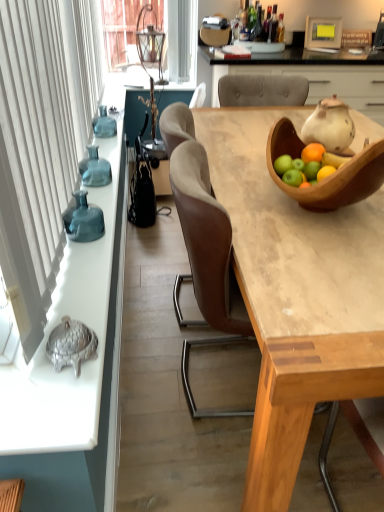
You are a GUI agent. You are given a task and a screenshot of the screen. Output one action in this format:
    pyautogui.click(x=<x>, y=<y>)
    Task: Click on the wooden cabinet at upper center
    Image resolution: width=384 pixels, height=512 pixels.
    Given the screenshot: What is the action you would take?
    pyautogui.click(x=308, y=75)

What is the approximate height of metallic silver turtle at left?

The height of metallic silver turtle at left is 0.94 inches.

What is the approximate width of metallic silver turtle at left?

metallic silver turtle at left is 9.29 inches in width.

Measure the distance between translucent glass vase at left and camera.

A distance of 2.25 meters exists between translucent glass vase at left and camera.

Where is `translucent glass vase at left`? The height and width of the screenshot is (512, 384). translucent glass vase at left is located at coordinates (104, 124).

Where is `wooden bowl at upper right`? The height and width of the screenshot is (512, 384). wooden bowl at upper right is located at coordinates [x=331, y=175].

Locate an element on the screen. wooden cabinet at upper center is located at coordinates (308, 75).

Identify the location of countertop below the translucent glass vase at left (from the image's perspective). The height and width of the screenshot is (512, 384). (47, 339).

Consider the image. Considering the relative sizes of translucent glass vase at left and metallic silver turtle at left in the image provided, is translucent glass vase at left thinner than metallic silver turtle at left?

Correct, the width of translucent glass vase at left is less than that of metallic silver turtle at left.

From the image's perspective, between translucent glass vase at left and metallic silver turtle at left, who is located below?

metallic silver turtle at left appears lower in the image.

Is translucent glass vase at left far away from metallic silver turtle at left?

No, there isn't a large distance between translucent glass vase at left and metallic silver turtle at left.

Does point (103, 161) come behind point (296, 197)?

Yes, it is behind point (296, 197).

Would you say wooden bowl at upper right is part of translucent glass vase at left, the first vase viewed from the back,'s contents?

No, wooden bowl at upper right is not surrounded by translucent glass vase at left, the first vase viewed from the back.

Does translucent glass vase at left, the first vase viewed from the back, have a greater width compared to wooden bowl at upper right?

No, translucent glass vase at left, the first vase viewed from the back, is not wider than wooden bowl at upper right.

Is translucent glass vase at left, the 2th vase from the bottom, touching wooden bowl at upper right?

There is a gap between translucent glass vase at left, the 2th vase from the bottom, and wooden bowl at upper right.

Does translucent glass vase at left, which is the 1th vase from top to bottom, have a lesser height compared to wooden table at center?

Indeed, translucent glass vase at left, which is the 1th vase from top to bottom, has a lesser height compared to wooden table at center.

Is translucent glass vase at left, the second vase positioned from the front, bigger than wooden table at center?

Incorrect, translucent glass vase at left, the second vase positioned from the front, is not larger than wooden table at center.

Identify the location of the 2nd vase located above the wooden table at center (from a real-world perspective). (95, 169).

Where is `desk lying in front of the wooden cabinet at upper center`? Image resolution: width=384 pixels, height=512 pixels. desk lying in front of the wooden cabinet at upper center is located at coordinates (295, 294).

Would you say wooden table at center is outside wooden cabinet at upper center?

Absolutely, wooden table at center is external to wooden cabinet at upper center.

Who is shorter, wooden table at center or wooden cabinet at upper center?

wooden cabinet at upper center.

Would you say metallic silver turtle at left is to the left or to the right of translucent glass vase at left in the picture?

In the image, metallic silver turtle at left appears on the left side of translucent glass vase at left.

Is metallic silver turtle at left aimed at translucent glass vase at left?

No, metallic silver turtle at left is not facing towards translucent glass vase at left.

Considering their positions, is metallic silver turtle at left located in front of or behind translucent glass vase at left?

Visually, metallic silver turtle at left is located in front of translucent glass vase at left.

Which of these two, metallic silver turtle at left or translucent glass vase at left, stands taller?

With more height is translucent glass vase at left.

Between translucent glass vase at left and teal glass vase at left, which is counted as the second vase, starting from the back, which one appears on the left side from the viewer's perspective?

From the viewer's perspective, translucent glass vase at left appears more on the left side.

From a real-world perspective, is translucent glass vase at left positioned above or below teal glass vase at left, which is counted as the second vase, starting from the back?

translucent glass vase at left is situated higher than teal glass vase at left, which is counted as the second vase, starting from the back, in the real world.

What's the angular difference between translucent glass vase at left and teal glass vase at left, the 1th vase from the front,'s facing directions?

The facing directions of translucent glass vase at left and teal glass vase at left, the 1th vase from the front, are 0.0004 degrees apart.

From the image's perspective, who appears lower, translucent glass vase at left or teal glass vase at left, the 1th vase from the front?

teal glass vase at left, the 1th vase from the front, from the image's perspective.

Which point is more distant from viewer, (83, 206) or (83, 165)?

The point (83, 165) is more distant.

From a real-world perspective, which object stands above the other?

translucent glass vase at left, which is the 1th vase from top to bottom, is physically above.

From the image's perspective, which object appears higher, teal glass vase at left, which is counted as the second vase, starting from the back, or translucent glass vase at left, the 2th vase from the bottom?

translucent glass vase at left, the 2th vase from the bottom, is shown above in the image.

Image resolution: width=384 pixels, height=512 pixels. What are the coordinates of `bottle above the metallic silver turtle at left (from a real-world perspective)` in the screenshot? It's located at pos(104,124).

Locate an element on the screen. tableware lying below the translucent glass vase at left, which is the 1th vase from top to bottom (from the image's perspective) is located at coordinates (331, 175).

Which object lies further to the anchor point teal glass vase at left, the 1th vase from the front, wooden bowl at upper right or wooden table at center?

Among the two, wooden bowl at upper right is located further to teal glass vase at left, the 1th vase from the front.

Based on their spatial positions, is wooden table at center or translucent glass vase at left closer to metallic silver turtle at left?

The object closer to metallic silver turtle at left is wooden table at center.

Based on their spatial positions, is metallic silver turtle at left or wooden cabinet at upper center closer to teal glass vase at left, the 1th vase from the front?

The object closer to teal glass vase at left, the 1th vase from the front, is metallic silver turtle at left.

From the picture: From the image, which object appears to be nearer to wooden bowl at upper right, wooden table at center or translucent glass vase at left, the second vase positioned from the front?

wooden table at center is positioned closer to the anchor wooden bowl at upper right.

Which object lies nearer to the anchor point translucent glass vase at left, the 2th vase from the bottom, teal glass vase at left, the 1th vase from the front, or wooden table at center?

teal glass vase at left, the 1th vase from the front.

Which object lies further to the anchor point wooden table at center, translucent glass vase at left, the second vase positioned from the front, or wooden cabinet at upper center?

wooden cabinet at upper center lies further to wooden table at center than the other object.

Which object lies nearer to the anchor point wooden cabinet at upper center, teal glass vase at left, the 1th vase from the front, or translucent glass vase at left, the 2th vase from the bottom?

translucent glass vase at left, the 2th vase from the bottom, is positioned closer to the anchor wooden cabinet at upper center.

Which object lies nearer to the anchor point metallic silver turtle at left, translucent glass vase at left or teal glass vase at left, the 1th vase when ordered from bottom to top?

teal glass vase at left, the 1th vase when ordered from bottom to top, lies closer to metallic silver turtle at left than the other object.

The image size is (384, 512). Find the location of `vase located between translucent glass vase at left, which is the 1th vase from top to bottom, and wooden cabinet at upper center in the left-right direction`. vase located between translucent glass vase at left, which is the 1th vase from top to bottom, and wooden cabinet at upper center in the left-right direction is located at coordinates (83, 220).

Identify the location of tableware between wooden table at center and wooden cabinet at upper center from front to back. Image resolution: width=384 pixels, height=512 pixels. [331, 175].

Image resolution: width=384 pixels, height=512 pixels. Identify the location of countertop located between wooden table at center and translucent glass vase at left in the depth direction. (47, 339).

Where is `tableware between metallic silver turtle at left and wooden cabinet at upper center in the front-back direction`? tableware between metallic silver turtle at left and wooden cabinet at upper center in the front-back direction is located at coordinates (331, 175).